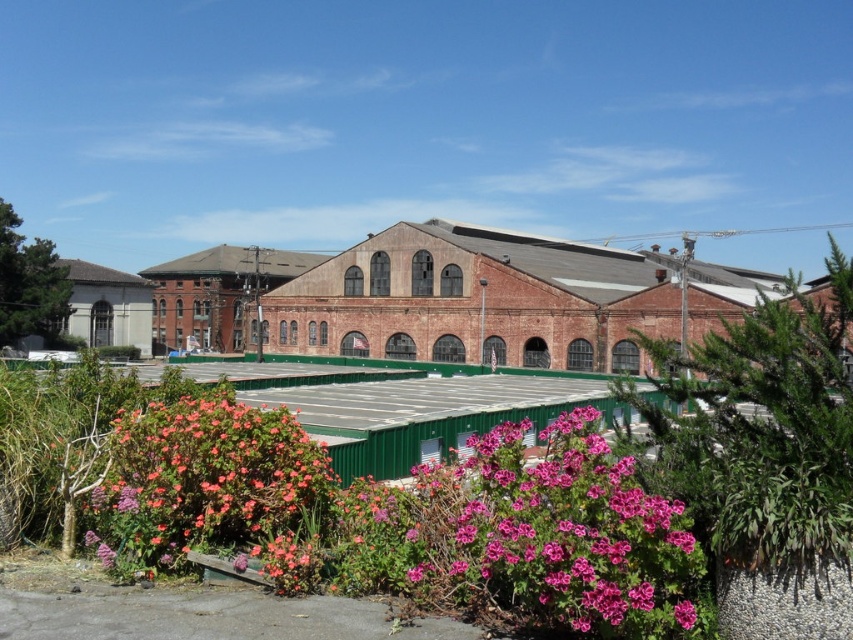
Question: Considering the relative positions of pink matte flower at lower left and pink matte flower at lower right in the image provided, where is pink matte flower at lower left located with respect to pink matte flower at lower right?

Choices:
 (A) right
 (B) left

Answer: (B)

Question: Among these objects, which one is nearest to the camera?

Choices:
 (A) pink matte flower at lower right
 (B) pink matte flower at lower center
 (C) pink matte flower at lower left

Answer: (A)

Question: Is pink matte flower at lower left closer to the viewer compared to pink matte flower at lower right?

Choices:
 (A) no
 (B) yes

Answer: (A)

Question: Which is nearer to the pink matte flower at lower left?

Choices:
 (A) pink matte flower at lower right
 (B) pink matte flower at lower center

Answer: (B)

Question: Is pink matte flower at lower left above pink matte flower at lower right?

Choices:
 (A) yes
 (B) no

Answer: (A)

Question: Which point is closer to the camera?

Choices:
 (A) (231, 392)
 (B) (683, 605)
 (C) (282, 589)

Answer: (B)